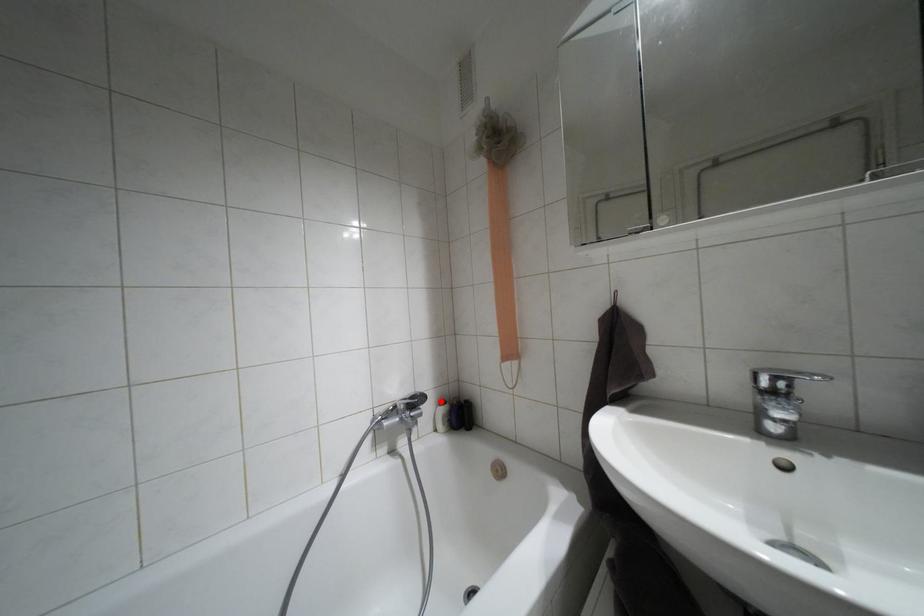
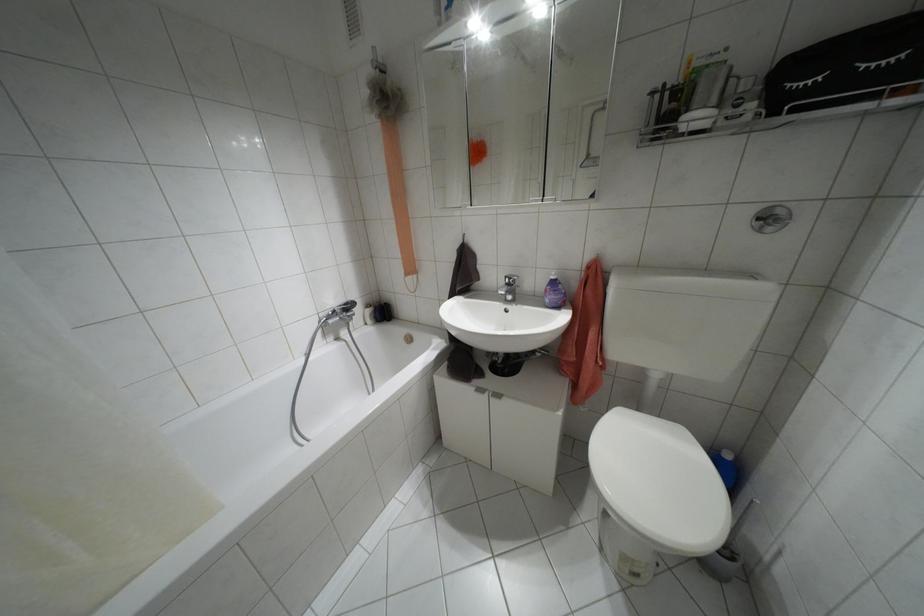
Question: A red point is marked in image1. In image2, is the corresponding 3D point closer to the camera or farther? Reply with the corresponding letter.

Choices:
 (A) The corresponding 3D point is closer.
 (B) The corresponding 3D point is farther.

Answer: (A)